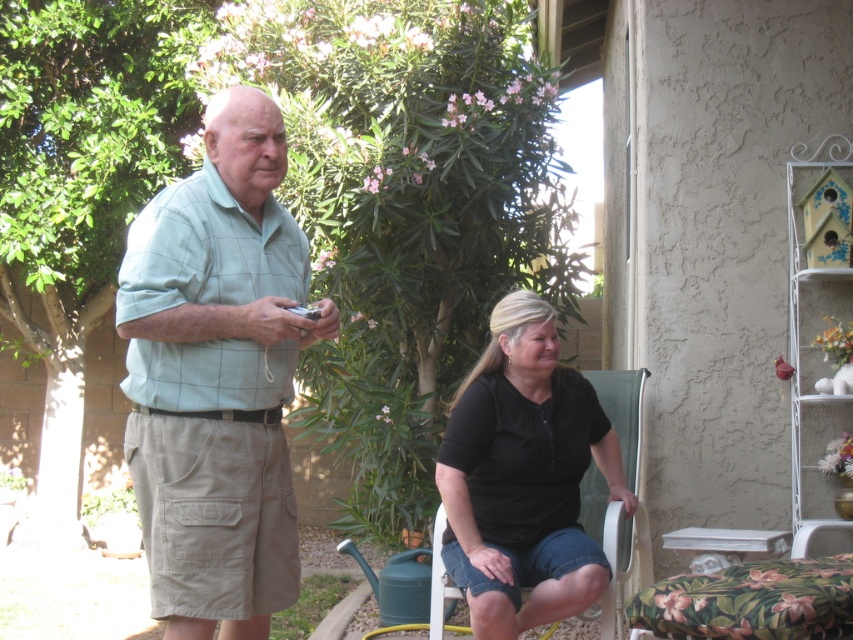
Question: Is green plaid shirt at center positioned behind black cotton shirt at center?

Choices:
 (A) yes
 (B) no

Answer: (B)

Question: Among these objects, which one is nearest to the camera?

Choices:
 (A) green plaid shirt at center
 (B) black cotton shirt at center

Answer: (A)

Question: Can you confirm if green plaid shirt at center is positioned to the right of black cotton shirt at center?

Choices:
 (A) no
 (B) yes

Answer: (A)

Question: Considering the relative positions of green plaid shirt at center and black cotton shirt at center in the image provided, where is green plaid shirt at center located with respect to black cotton shirt at center?

Choices:
 (A) right
 (B) left

Answer: (B)